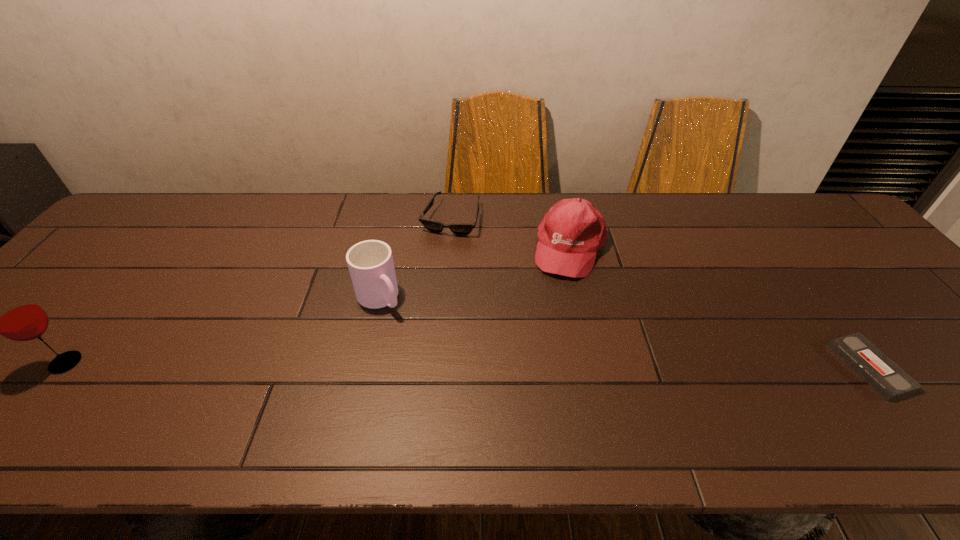
You are a GUI agent. You are given a task and a screenshot of the screen. Output one action in this format:
    pyautogui.click(x=<x>, y=<y>)
    Task: Click on the free space located with the handle on the side of the cup
    The height and width of the screenshot is (540, 960).
    Given the screenshot: What is the action you would take?
    pyautogui.click(x=450, y=383)

Find the location of a particular element. free space located with the handle on the side of the cup is located at coordinates (452, 387).

At what (x,y) coordinates should I click in order to perform the action: click on free space located 0.200m with the handle on the side of the cup. Please return your answer as a coordinate pair (x, y). The height and width of the screenshot is (540, 960). Looking at the image, I should click on (437, 368).

Where is `free region located at the front of the fourth object from left to right with the brim`? This screenshot has height=540, width=960. free region located at the front of the fourth object from left to right with the brim is located at coordinates (549, 336).

Where is `free region located 0.050m at the front of the fourth object from left to right with the brim`? This screenshot has height=540, width=960. free region located 0.050m at the front of the fourth object from left to right with the brim is located at coordinates (561, 293).

Find the location of a particular element. vacant region located at the front of the fourth object from left to right with the brim is located at coordinates (552, 323).

This screenshot has height=540, width=960. Identify the location of vacant space situated 0.090m on the front-facing side of the third object from right to left. (436, 258).

Locate an element on the screen. The width and height of the screenshot is (960, 540). free spot located on the front-facing side of the third object from right to left is located at coordinates (424, 288).

Where is `vacant area situated on the front-facing side of the third object from right to left`? vacant area situated on the front-facing side of the third object from right to left is located at coordinates (405, 335).

This screenshot has width=960, height=540. In order to click on baseball cap present at the far edge in this screenshot , I will do `click(571, 233)`.